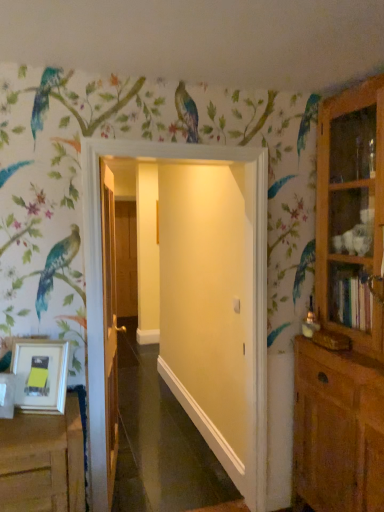
Question: Is white matte picture frame at lower left positioned with its back to wooden door at center, acting as the second door starting from the back?

Choices:
 (A) no
 (B) yes

Answer: (B)

Question: Is white matte picture frame at lower left oriented towards wooden door at center, marked as the 2th door in a front-to-back arrangement?

Choices:
 (A) no
 (B) yes

Answer: (A)

Question: Considering the relative positions of white matte picture frame at lower left and wooden door at center, which is counted as the second door, starting from the left, in the image provided, is white matte picture frame at lower left to the right of wooden door at center, which is counted as the second door, starting from the left, from the viewer's perspective?

Choices:
 (A) yes
 (B) no

Answer: (B)

Question: Can you confirm if white matte picture frame at lower left is taller than wooden door at center, which is the 2th door in right-to-left order?

Choices:
 (A) yes
 (B) no

Answer: (B)

Question: From a real-world perspective, is white matte picture frame at lower left under wooden door at center, acting as the second door starting from the back?

Choices:
 (A) yes
 (B) no

Answer: (A)

Question: From the image's perspective, is white matte picture frame at lower left beneath wooden door at center, acting as the second door starting from the back?

Choices:
 (A) yes
 (B) no

Answer: (A)

Question: Can you confirm if white matte door at center, which ranks as the 3th door in back-to-front order, is positioned to the left of brown wooden door at center, arranged as the 1th door when viewed from the back?

Choices:
 (A) yes
 (B) no

Answer: (B)

Question: Is white matte door at center, the first door positioned from the right, not within brown wooden door at center, which appears as the 1th door when viewed from the left?

Choices:
 (A) no
 (B) yes

Answer: (B)

Question: Considering the relative sizes of white matte door at center, the 3th door in the left-to-right sequence, and brown wooden door at center, the third door viewed from the right, in the image provided, is white matte door at center, the 3th door in the left-to-right sequence, bigger than brown wooden door at center, the third door viewed from the right,?

Choices:
 (A) no
 (B) yes

Answer: (B)

Question: From the image's perspective, is white matte door at center, the first door from the front, below brown wooden door at center, acting as the 3th door starting from the front?

Choices:
 (A) yes
 (B) no

Answer: (A)

Question: Considering the relative sizes of white matte door at center, the first door from the front, and brown wooden door at center, arranged as the 1th door when viewed from the back, in the image provided, is white matte door at center, the first door from the front, smaller than brown wooden door at center, arranged as the 1th door when viewed from the back,?

Choices:
 (A) yes
 (B) no

Answer: (B)

Question: From a real-world perspective, is white matte door at center, the first door from the front, positioned over brown wooden door at center, the third door viewed from the right, based on gravity?

Choices:
 (A) no
 (B) yes

Answer: (B)

Question: Is wooden door at center, acting as the second door starting from the back, bigger than brown wooden door at center, acting as the 3th door starting from the front?

Choices:
 (A) yes
 (B) no

Answer: (A)